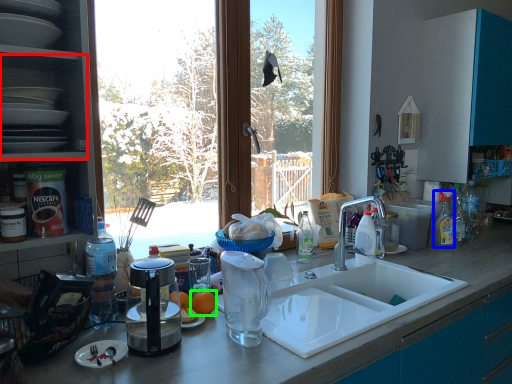
Question: Estimate the real-world distances between objects in this image. Which object is farther from shelf (highlighted by a red box), cleaning product (highlighted by a blue box) or orange (highlighted by a green box)?

Choices:
 (A) cleaning product
 (B) orange

Answer: (A)